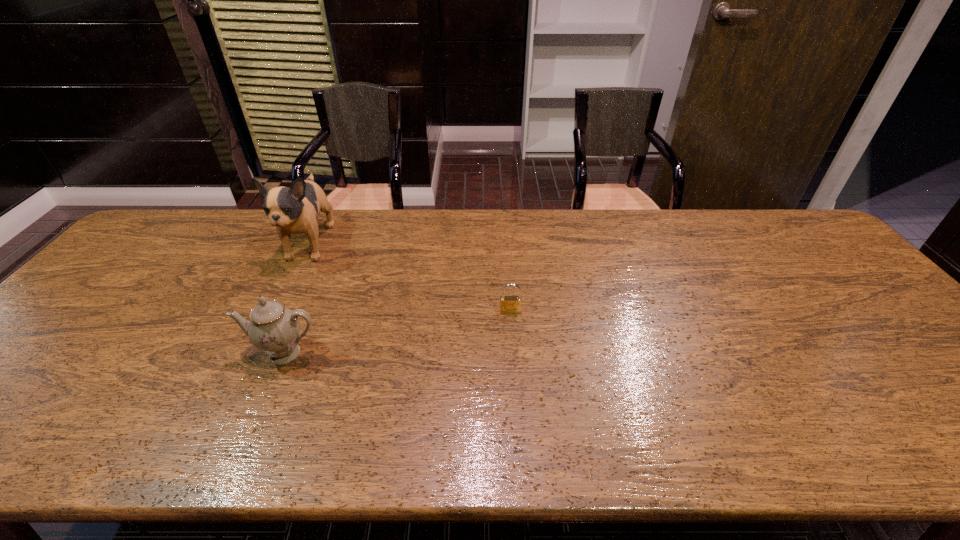
At what (x,y) coordinates should I click in order to perform the action: click on vacant space at the far edge of the desktop. Please return your answer as a coordinate pair (x, y). Looking at the image, I should click on (471, 218).

In the image, there is a desktop. Find the location of `free region at the near edge`. free region at the near edge is located at coordinates (826, 429).

Locate an element on the screen. vacant space at the far right corner of the desktop is located at coordinates (780, 239).

The height and width of the screenshot is (540, 960). In order to click on vacant area between the second shortest object and the shortest object in this screenshot , I will do `click(397, 332)`.

Identify the location of unoccupied area between the second tallest object and the rightmost object. The height and width of the screenshot is (540, 960). (397, 332).

Locate an element on the screen. This screenshot has width=960, height=540. vacant point located between the tallest object and the second shortest object is located at coordinates (298, 299).

You are a GUI agent. You are given a task and a screenshot of the screen. Output one action in this format:
    pyautogui.click(x=<x>, y=<y>)
    Task: Click on the unoccupied area between the rightmost object and the nearest object
    
    Given the screenshot: What is the action you would take?
    pyautogui.click(x=397, y=332)

The height and width of the screenshot is (540, 960). I want to click on unoccupied position between the farthest object and the second farthest object, so click(410, 278).

Locate an element on the screen. Image resolution: width=960 pixels, height=540 pixels. free space between the chinaware and the tallest object is located at coordinates (298, 299).

Image resolution: width=960 pixels, height=540 pixels. I want to click on vacant space that's between the rightmost object and the second shortest object, so (397, 332).